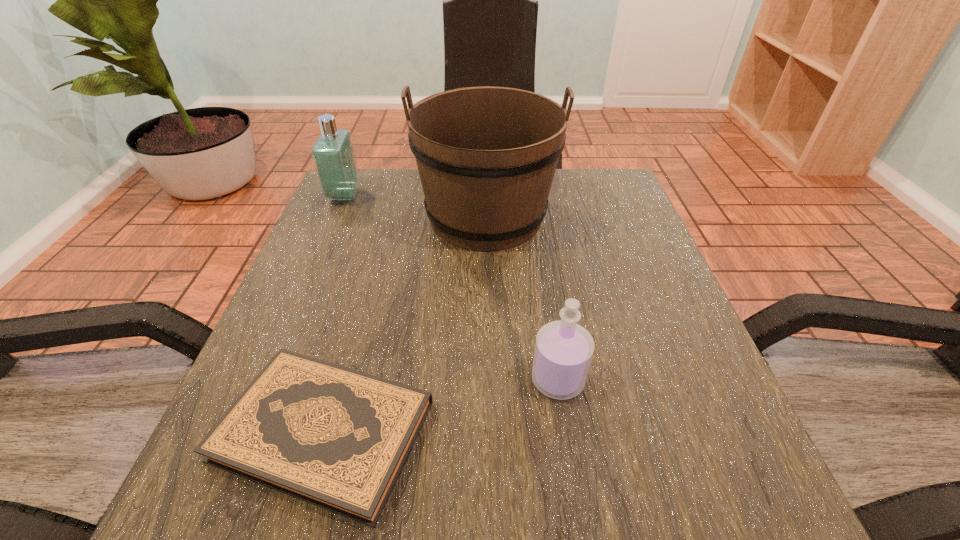
In the image, there is a desktop. Where is `vacant space at the near right corner`? The height and width of the screenshot is (540, 960). vacant space at the near right corner is located at coordinates (713, 522).

The image size is (960, 540). In order to click on blank region between the tallest object and the shortest object in this screenshot , I will do `click(405, 324)`.

Locate an element on the screen. The height and width of the screenshot is (540, 960). unoccupied position between the left perfume and the third tallest object is located at coordinates (451, 288).

You are a GUI agent. You are given a task and a screenshot of the screen. Output one action in this format:
    pyautogui.click(x=<x>, y=<y>)
    Task: Click on the free area in between the nearer perfume and the tallest object
    This screenshot has width=960, height=540.
    Given the screenshot: What is the action you would take?
    pyautogui.click(x=522, y=298)

The width and height of the screenshot is (960, 540). I want to click on free space between the shortest object and the farther perfume, so click(334, 313).

In order to click on free point between the tallest object and the left perfume in this screenshot , I will do `click(415, 206)`.

You are a GUI agent. You are given a task and a screenshot of the screen. Output one action in this format:
    pyautogui.click(x=<x>, y=<y>)
    Task: Click on the vacant area that lies between the left perfume and the right perfume
    This screenshot has width=960, height=540.
    Given the screenshot: What is the action you would take?
    pyautogui.click(x=451, y=288)

Identify the location of vacant space that's between the hardback book and the left perfume. The width and height of the screenshot is (960, 540). (334, 313).

Locate an element on the screen. This screenshot has height=540, width=960. unoccupied position between the shorter perfume and the bucket is located at coordinates [522, 298].

The height and width of the screenshot is (540, 960). In order to click on vacant space that is in between the left perfume and the bucket in this screenshot , I will do pyautogui.click(x=415, y=206).